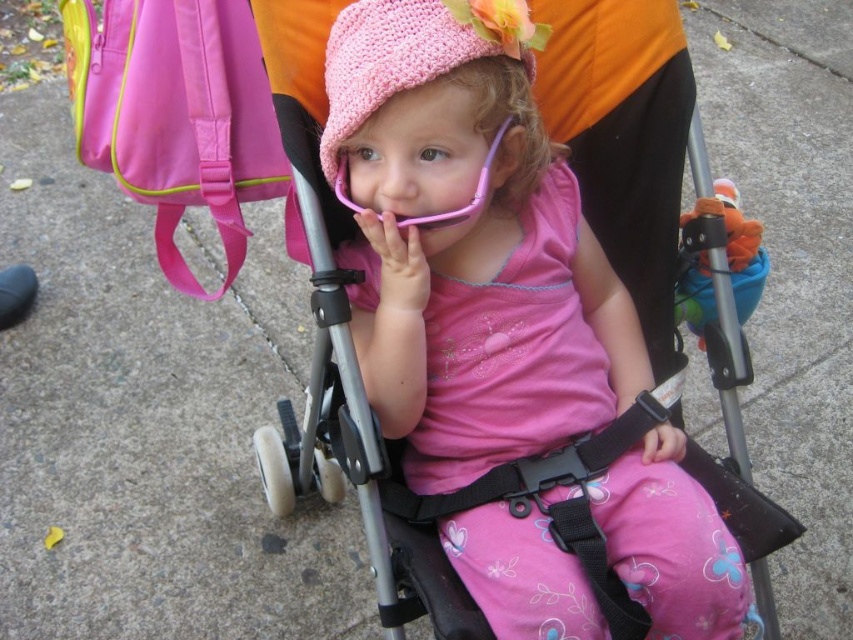
Can you confirm if pink knitted hat at center is positioned below crochet pink hat at center?

Yes.

Between pink knitted hat at center and crochet pink hat at center, which one is positioned higher?

Positioned higher is crochet pink hat at center.

Between point (625, 296) and point (328, 64), which one is positioned in front?

Positioned in front is point (328, 64).

The width and height of the screenshot is (853, 640). Find the location of `pink knitted hat at center`. pink knitted hat at center is located at coordinates (468, 250).